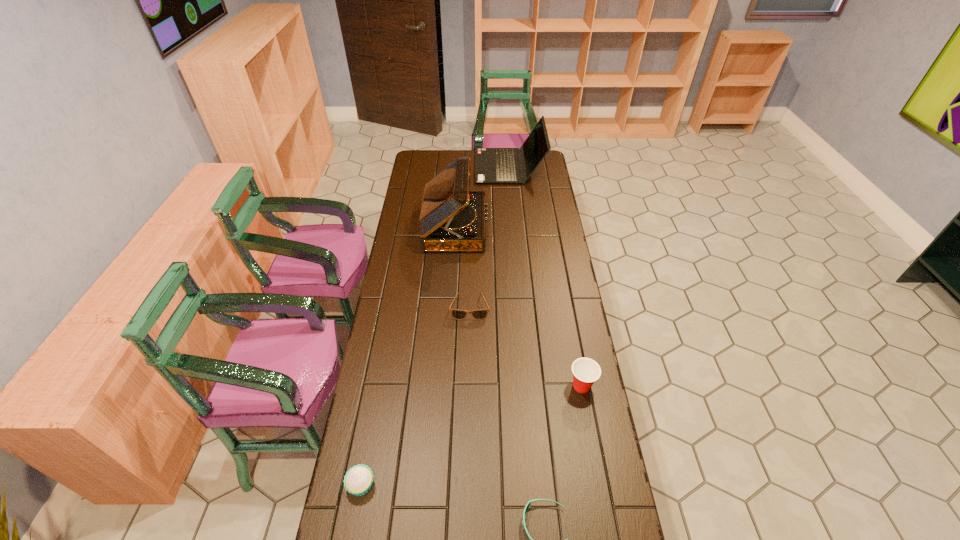
At what (x,y) coordinates should I click in order to perform the action: click on vacant region located on the screen of the farthest object. Please return your answer as a coordinate pair (x, y). The image size is (960, 540). Looking at the image, I should click on (457, 167).

Image resolution: width=960 pixels, height=540 pixels. Find the location of `vacant space located on the screen of the farthest object`. vacant space located on the screen of the farthest object is located at coordinates (463, 167).

Image resolution: width=960 pixels, height=540 pixels. What are the coordinates of `vacant space located 0.360m on the screen of the farthest object` in the screenshot? It's located at (411, 167).

Locate an element on the screen. The height and width of the screenshot is (540, 960). free location located on the back of the third nearest object is located at coordinates (567, 310).

Image resolution: width=960 pixels, height=540 pixels. Find the location of `free region located on the right of the cupcake`. free region located on the right of the cupcake is located at coordinates (420, 485).

I want to click on vacant region located on the frames of the farther sunglasses, so click(468, 367).

You are a GUI agent. You are given a task and a screenshot of the screen. Output one action in this format:
    pyautogui.click(x=<x>, y=<y>)
    Task: Click on the object that is at the far edge
    
    Given the screenshot: What is the action you would take?
    pyautogui.click(x=492, y=165)

Identify the location of record player located at the left edge. (452, 218).

What are the coordinates of `cupcake at the left edge` in the screenshot? It's located at (358, 480).

Locate an element on the screen. This screenshot has width=960, height=540. laptop computer situated at the right edge is located at coordinates tap(492, 165).